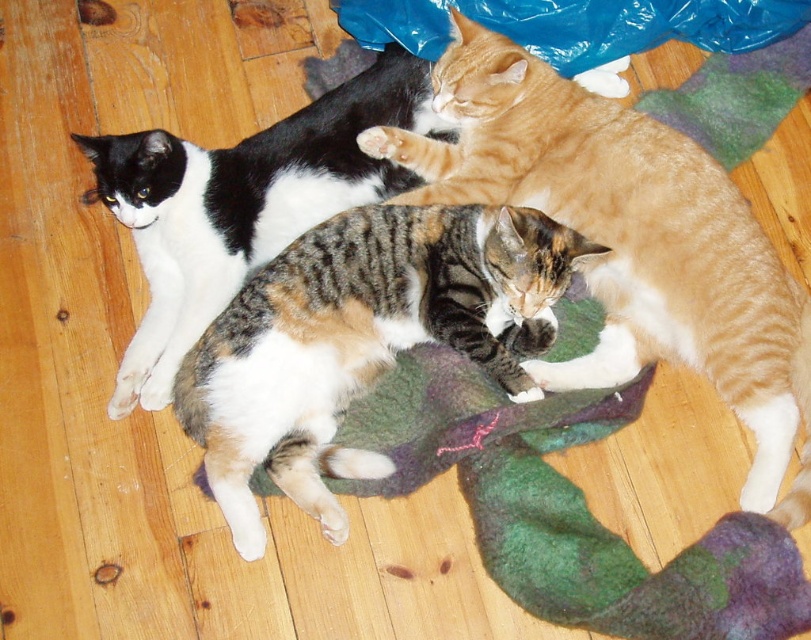
You are a cat owner who wants to ensure all your cats are comfortable. Given that the calico fur cat at center and the black and white fur cat at upper left are both on the rug, which cat is taking up more space on the rug?

The black and white fur cat at upper left is taking up more space on the rug because the calico fur cat at center occupies less space than it.

You are a photographer aiming to capture a photo of the calico fur cat at center and the black and white fur cat at upper left. Based on their positions, which cat would be in the lower part of the image?

The calico fur cat at center is located below the black and white fur cat at upper left, so the calico fur cat at center would be in the lower part of the image.